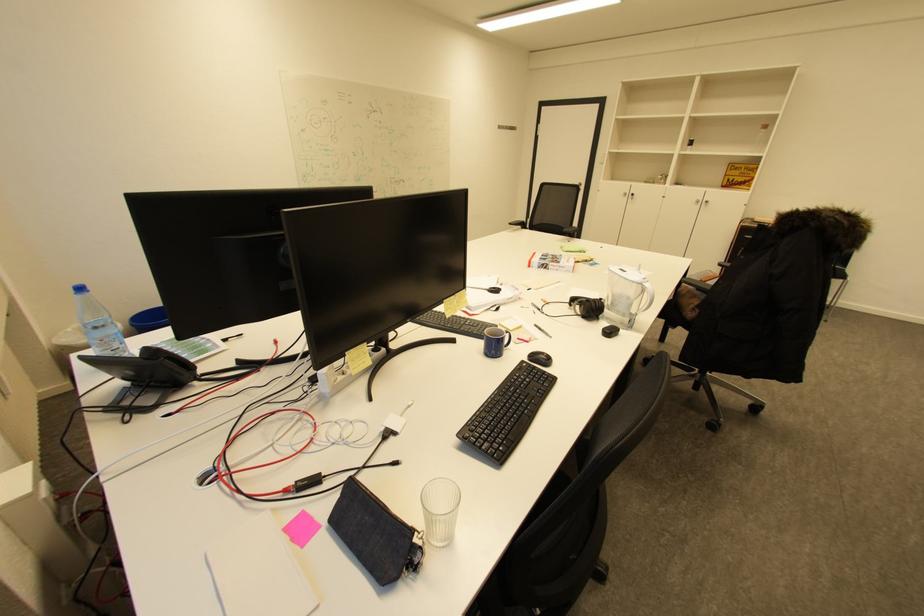
Locate an element on the screen. Image resolution: width=924 pixels, height=616 pixels. blue mug handle is located at coordinates (508, 331).